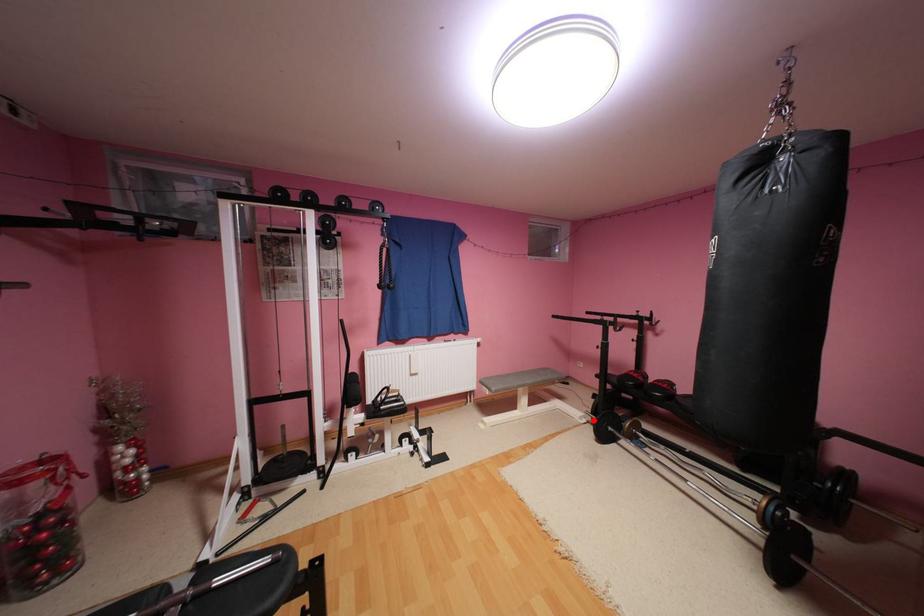
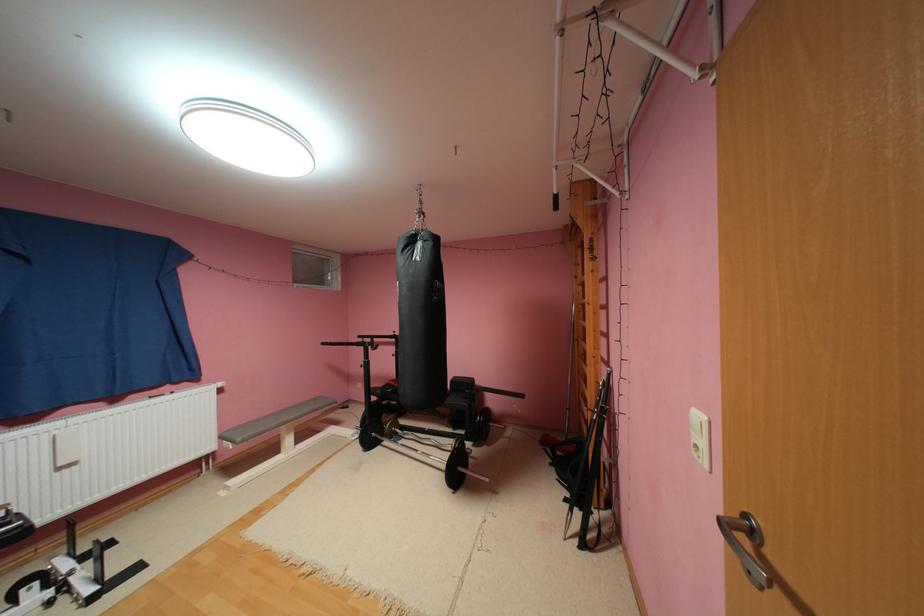
Question: I am providing you with two images of the same scene from different viewpoints. In image1, a red point is highlighted. Considering the same 3D point in image2, which of the following is correct?

Choices:
 (A) It is closer
 (B) It is farther

Answer: (B)